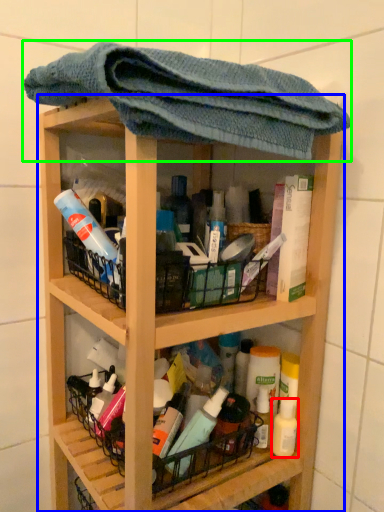
Question: Estimate the real-world distances between objects in this image. Which object is farther from mouthwash (highlighted by a red box), shelf (highlighted by a blue box) or towel (highlighted by a green box)?

Choices:
 (A) shelf
 (B) towel

Answer: (B)